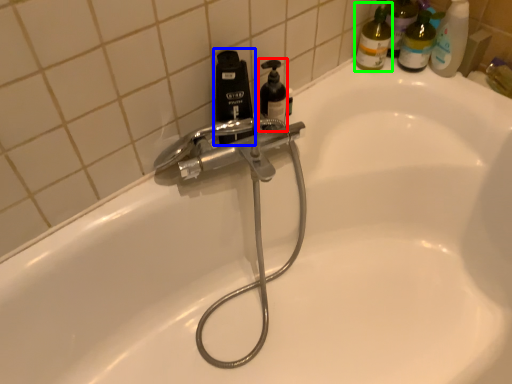
Question: Which object is the farthest from soap dispenser (highlighted by a red box)? Choose among these: bottle (highlighted by a blue box) or cleaning product (highlighted by a green box).

Choices:
 (A) bottle
 (B) cleaning product

Answer: (B)